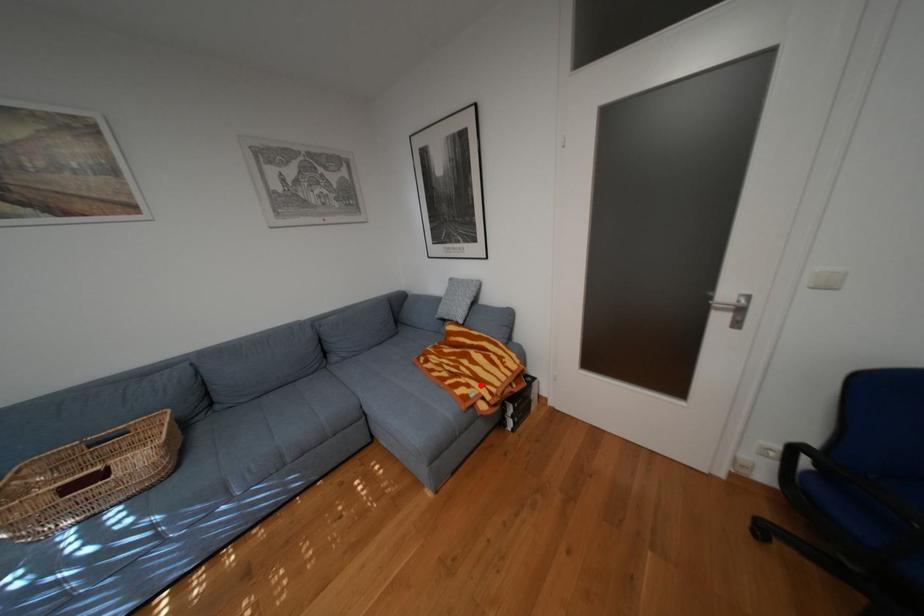
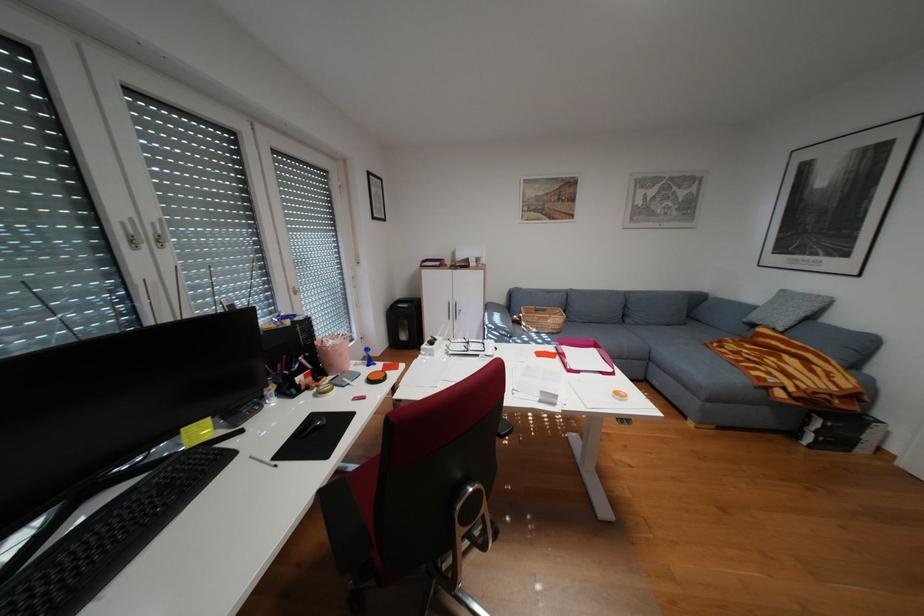
The point at the highlighted location is marked in the first image. Where is the corresponding point in the second image?

(782, 373)